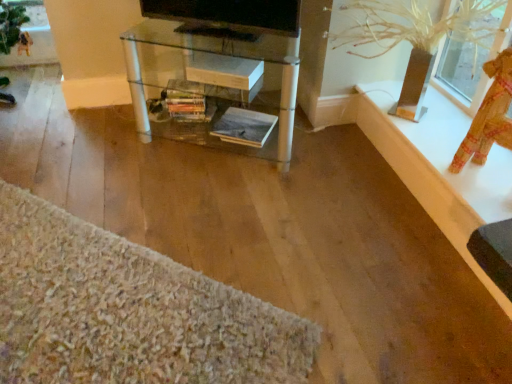
Find the location of `free point below textured beige rug at lower left (from a real-world perspective)`. free point below textured beige rug at lower left (from a real-world perspective) is located at coordinates (100, 296).